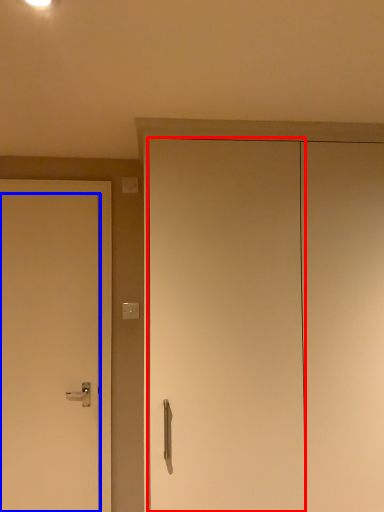
Question: Among these objects, which one is nearest to the camera, door (highlighted by a red box) or door (highlighted by a blue box)?

Choices:
 (A) door
 (B) door

Answer: (A)